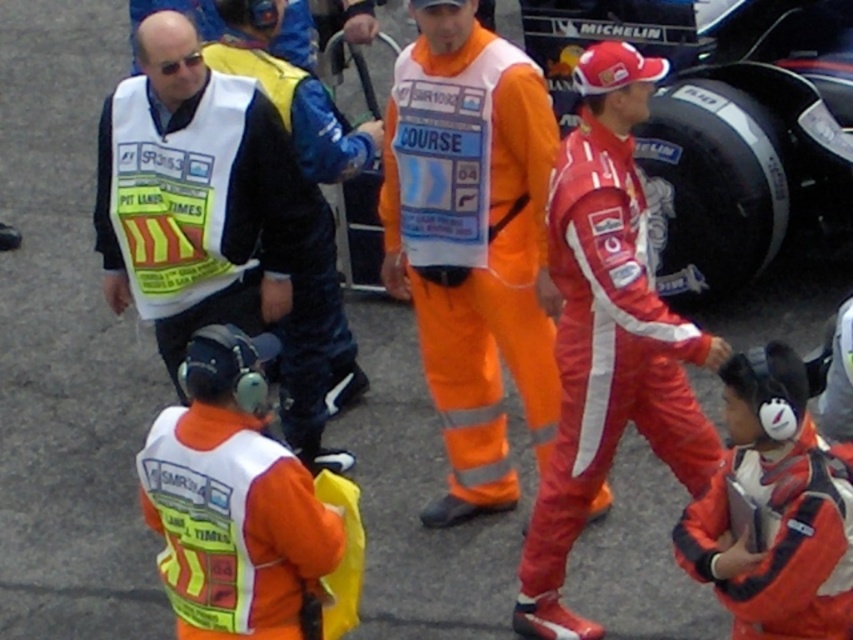
You are standing at the pit lane and need to reach both the point marked as point [524,358] and the point marked as point [344,332]. Which point should you approach first if you want to reach the one closer to you first?

You should approach point [524,358] first because it is closer to you than point [344,332].

You are standing at the point marked by the coordinates point (206, 211). Which object is located exactly at this point?

The point (206, 211) corresponds to the white reflective vest at left.